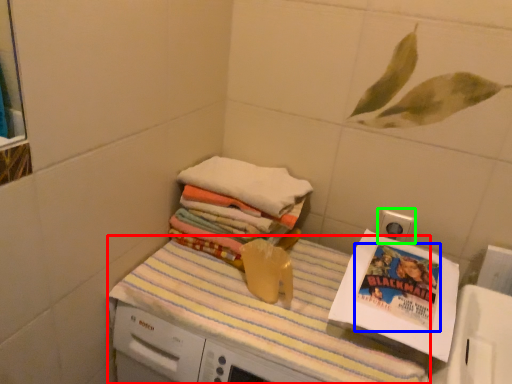
Question: Which object is positioned farthest from tablecloth (highlighted by a red box)? Select from comic book (highlighted by a blue box) and electric outlet (highlighted by a green box).

Choices:
 (A) comic book
 (B) electric outlet

Answer: (B)